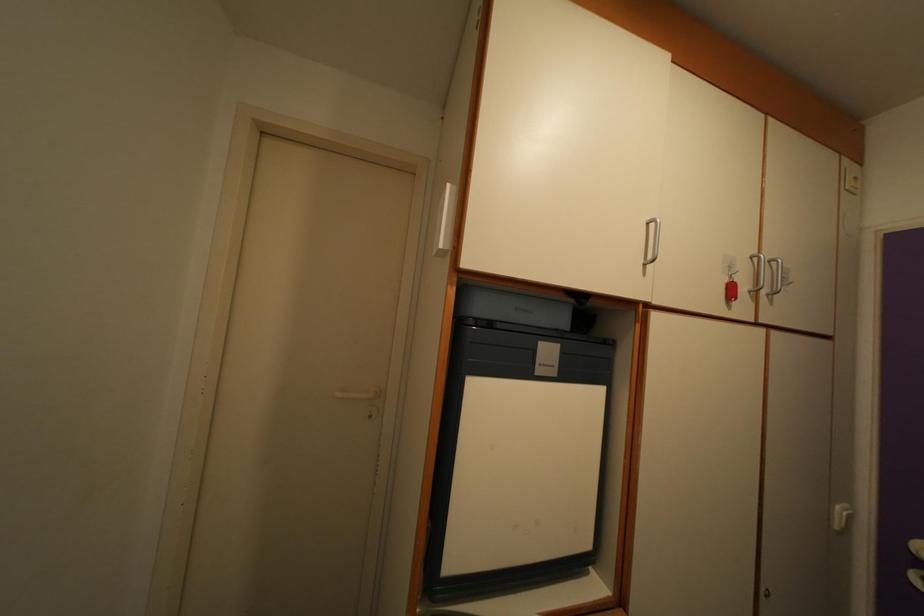
Describe the element at coordinates (841, 516) in the screenshot. This screenshot has height=616, width=924. I see `the white light switch` at that location.